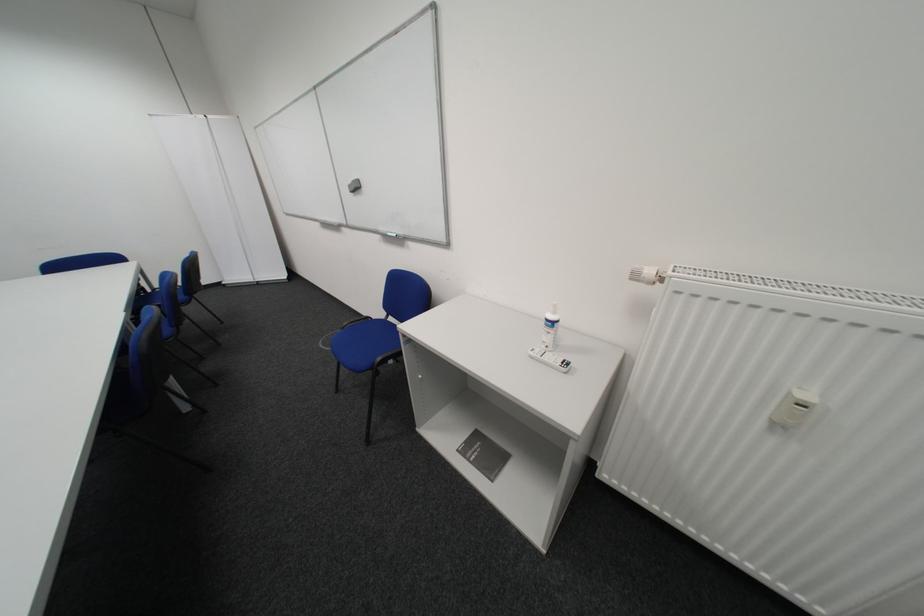
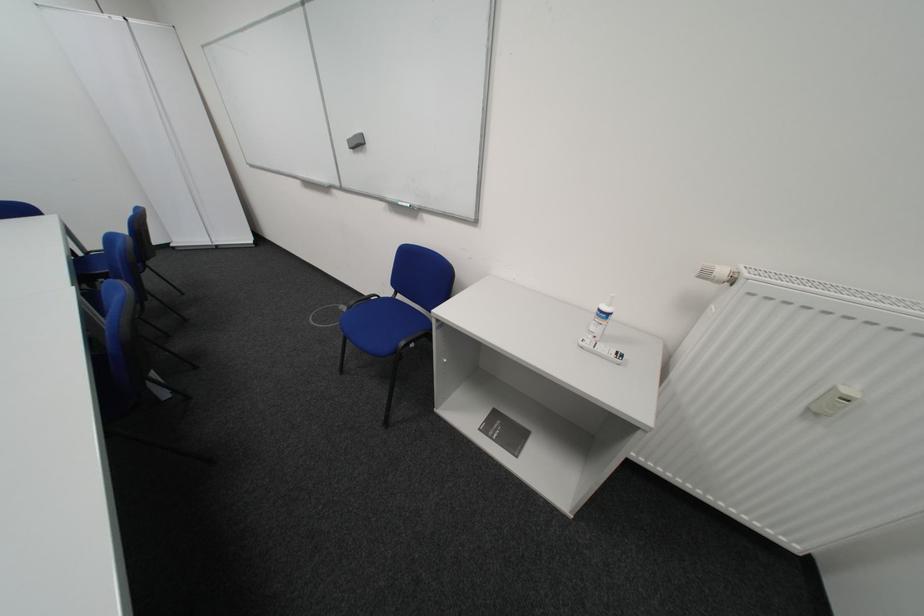
Find the pixel in the second image that matches point (642, 280) in the first image.

(710, 278)